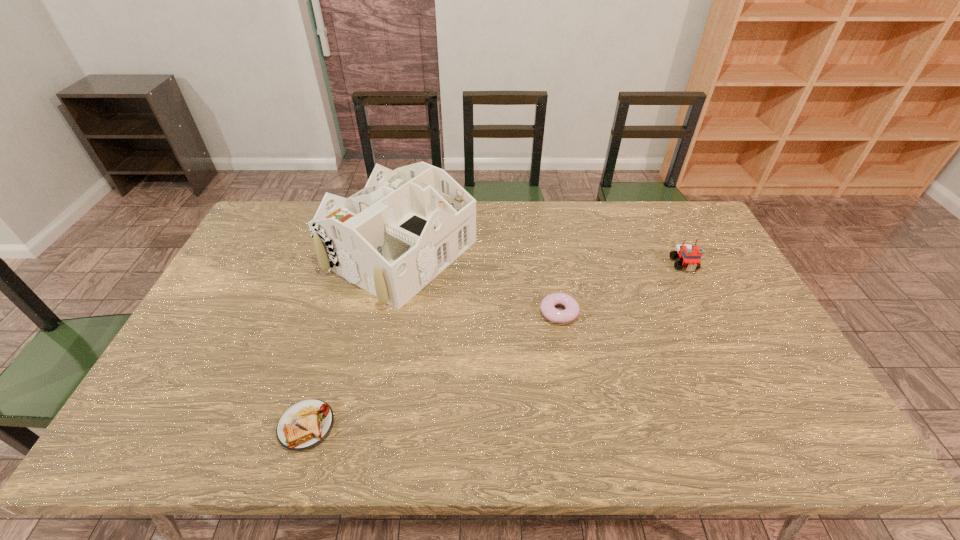
Locate an element on the screen. The image size is (960, 540). the third closest object to the tallest object is located at coordinates (689, 255).